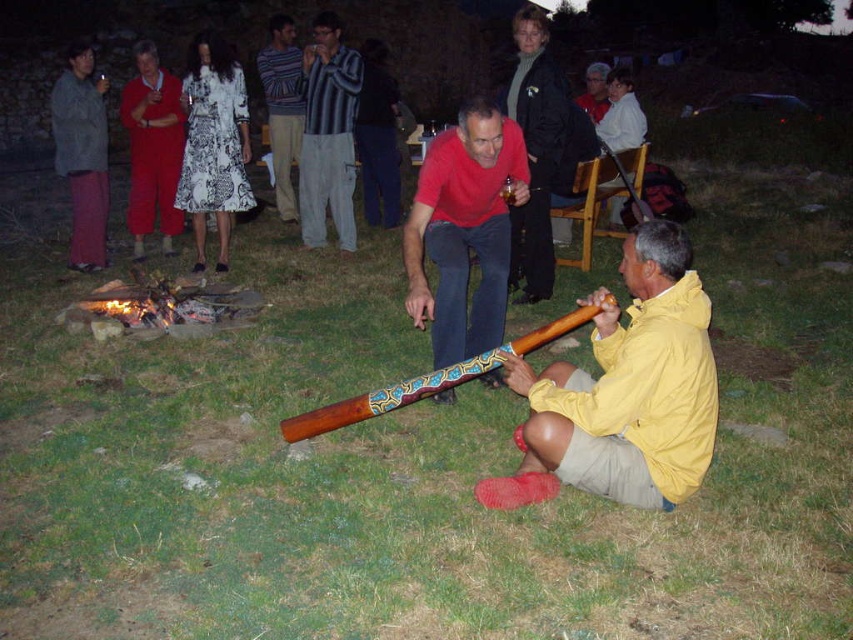
Who is lower down, striped cotton shirt at center or striped cotton shirt at upper center?

striped cotton shirt at center is below.

Which is in front, point (312, 113) or point (277, 184)?

Point (312, 113) is more forward.

Identify the location of striped cotton shirt at center. (328, 134).

Consider the image. Can you confirm if yellow matte jacket at lower right is bigger than matte black jacket at upper center?

No, yellow matte jacket at lower right is not bigger than matte black jacket at upper center.

Does point (648, 388) come farther from viewer compared to point (560, 102)?

No, (648, 388) is in front of (560, 102).

The height and width of the screenshot is (640, 853). I want to click on yellow matte jacket at lower right, so click(624, 392).

Is wooden painted didgeridoo at center positioned before striped cotton shirt at center?

Yes, it is in front of striped cotton shirt at center.

Is wooden painted didgeridoo at center bigger than striped cotton shirt at center?

No, wooden painted didgeridoo at center is not bigger than striped cotton shirt at center.

Does point (454, 150) lie behind point (341, 192)?

No.

The width and height of the screenshot is (853, 640). Find the location of `wooden painted didgeridoo at center`. wooden painted didgeridoo at center is located at coordinates (463, 230).